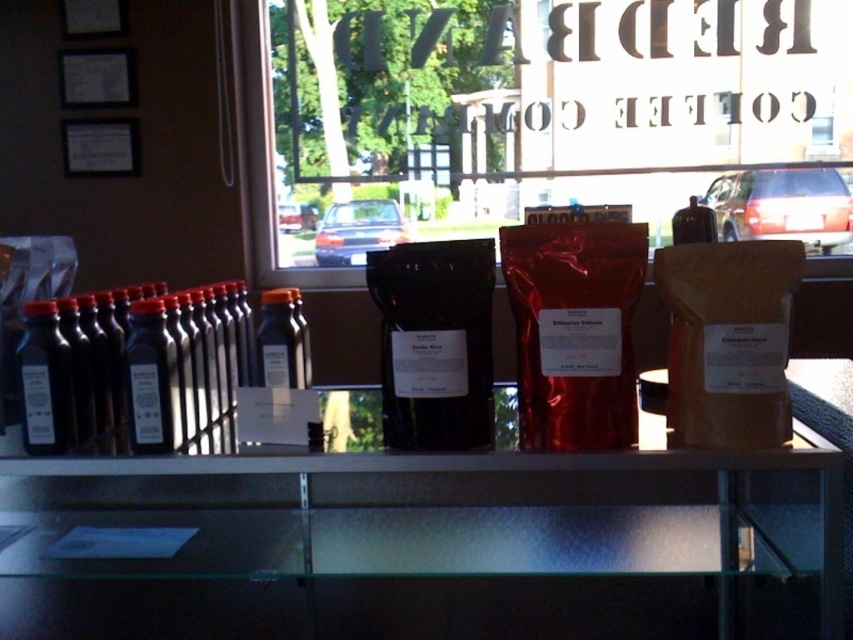
Question: Which of the following is the closest to the observer?

Choices:
 (A) transparent glass window at center
 (B) matte black bottle at left
 (C) black glass bottle at left

Answer: (B)

Question: Estimate the real-world distances between objects in this image. Which object is closer to the black glass bottle at left?

Choices:
 (A) black matte bottles at left
 (B) matte black bottle at left
 (C) clear glass shelf at center

Answer: (A)

Question: From the image, what is the correct spatial relationship of transparent glass window at center in relation to black matte bottles at left?

Choices:
 (A) left
 (B) right

Answer: (B)

Question: Is matte black bottle at left to the right of black glass bottle at left from the viewer's perspective?

Choices:
 (A) no
 (B) yes

Answer: (A)

Question: Estimate the real-world distances between objects in this image. Which object is farther from the black glass bottle at left?

Choices:
 (A) clear glass shelf at center
 (B) transparent glass window at center
 (C) black matte bottles at left
 (D) matte black bottle at left

Answer: (B)

Question: Observing the image, what is the correct spatial positioning of black matte bottles at left in reference to black glass bottle at left?

Choices:
 (A) left
 (B) right

Answer: (B)